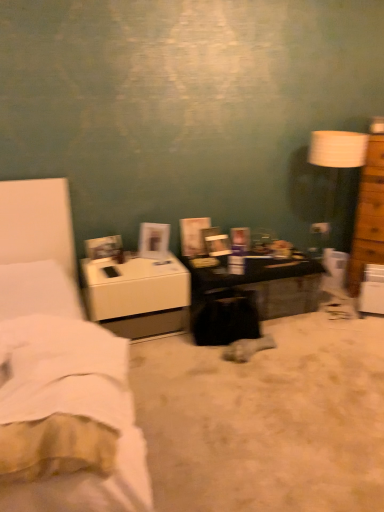
Question: From the image's perspective, is white soft fabric bedsheet at lower left above or below white fabric bed at left?

Choices:
 (A) below
 (B) above

Answer: (A)

Question: Is white soft fabric bedsheet at lower left wider or thinner than white fabric bed at left?

Choices:
 (A) thin
 (B) wide

Answer: (A)

Question: Which object is positioned closest to the black fabric swivel chair at center?

Choices:
 (A) dark brown wooden desk at center
 (B) white soft fabric bedsheet at lower left
 (C) black fabric bag at center
 (D) brown wooden chest of drawers at right
 (E) white glossy nightstand at left

Answer: (A)

Question: Estimate the real-world distances between objects in this image. Which object is closer to the black fabric swivel chair at center?

Choices:
 (A) white fabric bed at left
 (B) white soft fabric bedsheet at lower left
 (C) black fabric bag at center
 (D) dark brown wooden desk at center
 (E) white glossy nightstand at left

Answer: (D)